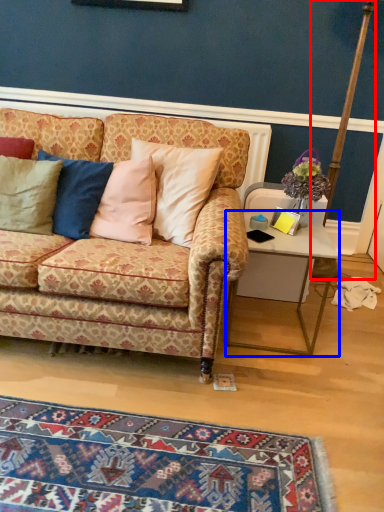
Question: Which point is closer to the camera, pole (highlighted by a red box) or desk (highlighted by a blue box)?

Choices:
 (A) pole
 (B) desk

Answer: (B)